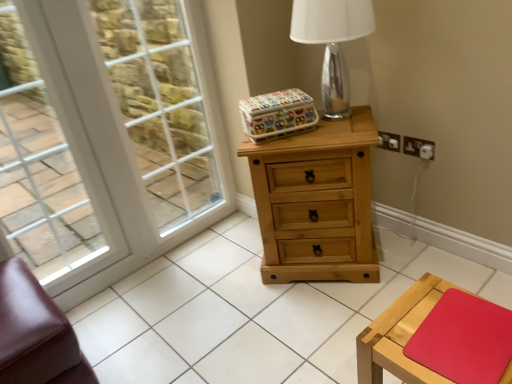
Question: Relative to brown leather ottoman at lower left, is natural wood chest of drawers at center in front or behind?

Choices:
 (A) behind
 (B) front

Answer: (A)

Question: From a real-world perspective, relative to brown leather ottoman at lower left, is natural wood chest of drawers at center vertically above or below?

Choices:
 (A) above
 (B) below

Answer: (A)

Question: Based on their relative distances, which object is nearer to the white glass window screen at upper left?

Choices:
 (A) transparent glass table lamp at upper center
 (B) wooden table at lower right
 (C) natural wood chest of drawers at center
 (D) white glass window at left
 (E) white plastic electrical outlet at upper right, which is counted as the second electric outlet, starting from the left

Answer: (D)

Question: Which object is positioned closest to the wooden table at lower right?

Choices:
 (A) white glass window at left
 (B) natural wood tile at center
 (C) white plastic electrical outlet at upper right, which is counted as the second electric outlet, starting from the left
 (D) white glass window screen at upper left
 (E) brown leather ottoman at lower left

Answer: (B)